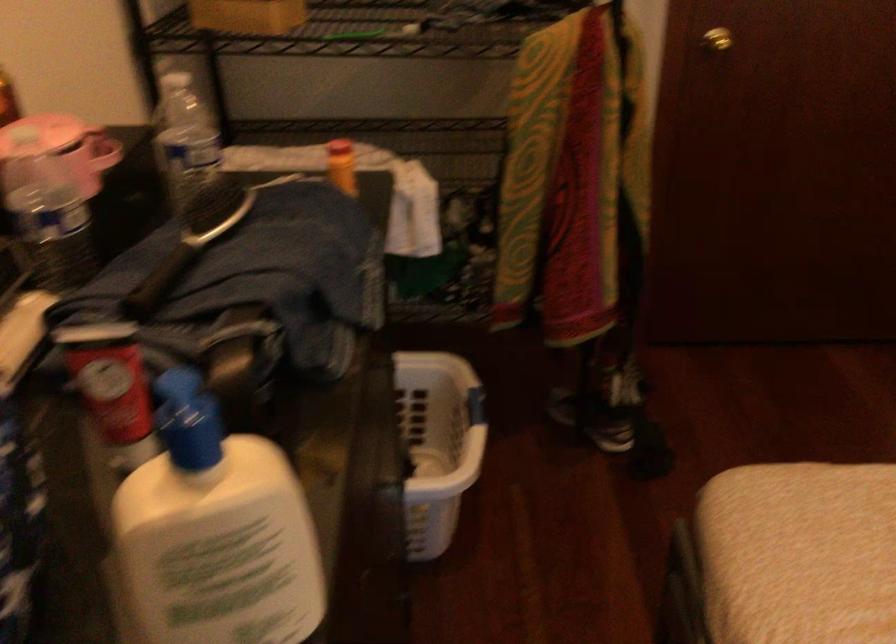
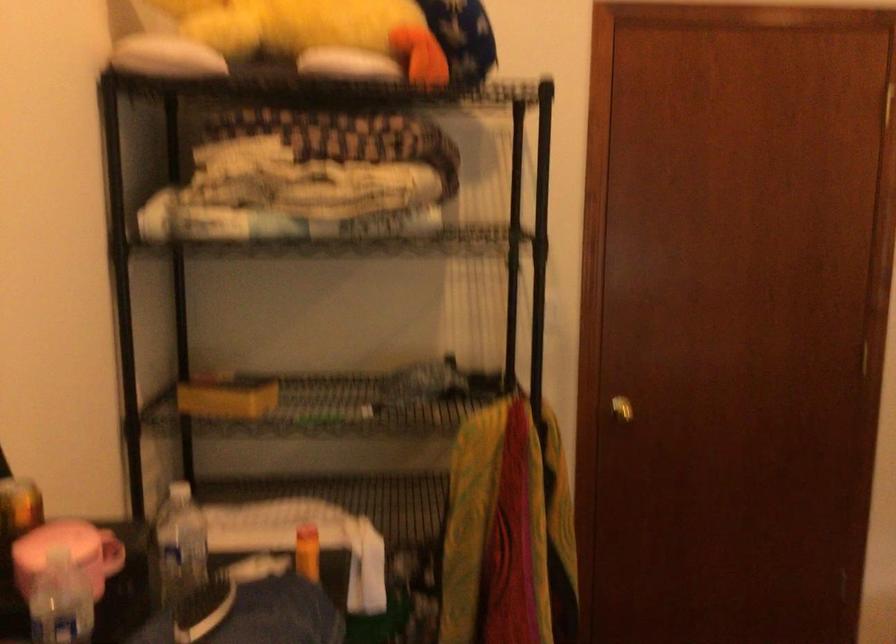
Question: The images are taken continuously from a first-person perspective. In which direction is your viewpoint rotating?

Choices:
 (A) Left
 (B) Right
 (C) Up
 (D) Down

Answer: (C)